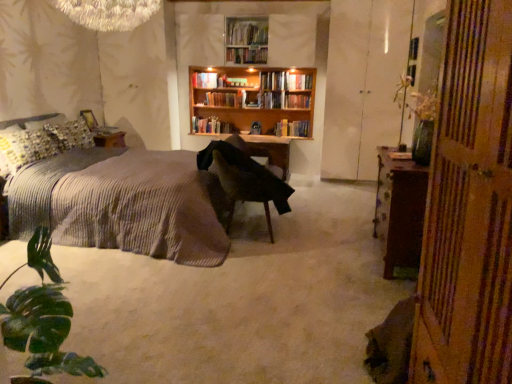
Question: In terms of width, does wooden bookshelf at center, which is counted as the 5th book, starting from the bottom, look wider or thinner when compared to green glass vase at right?

Choices:
 (A) wide
 (B) thin

Answer: (B)

Question: Considering the positions of wooden bookshelf at center, the 1th book viewed from the top, and green glass vase at right in the image, is wooden bookshelf at center, the 1th book viewed from the top, bigger or smaller than green glass vase at right?

Choices:
 (A) big
 (B) small

Answer: (B)

Question: Estimate the real-world distances between objects in this image. Which object is farther from the wooden bookshelf at upper center?

Choices:
 (A) wooden bookshelf at center, which is counted as the 5th book, starting from the bottom
 (B) hardcover book at center, positioned as the fourth book in bottom-to-top order
 (C) hardcover book at center, acting as the 4th book starting from the top
 (D) hardcover book at center, arranged as the 3th book when viewed from the top
 (E) green glass vase at right

Answer: (E)

Question: Which of these objects is positioned closest to the white glossy cabinet at right?

Choices:
 (A) black fabric chair at center
 (B) green glass vase at right
 (C) textured gray bedspread at left
 (D) brown wooden cabinet at right
 (E) wooden bookshelf at upper center

Answer: (E)